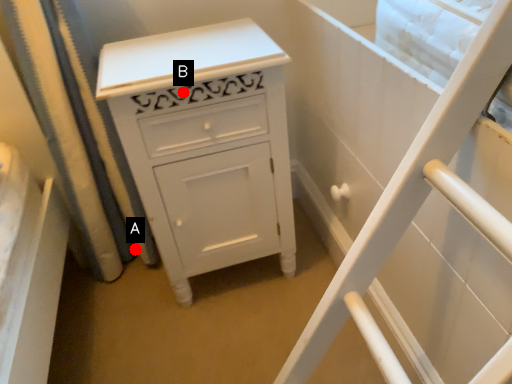
Question: Two points are circled on the image, labeled by A and B beside each circle. Which point is closer to the camera?

Choices:
 (A) A is closer
 (B) B is closer

Answer: (B)